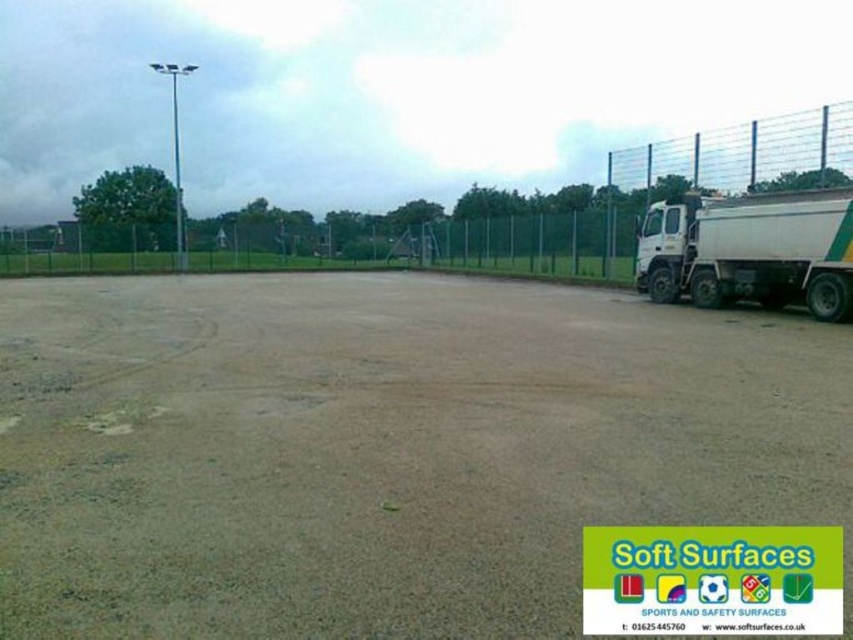
Which of these two, brown gravel dirt field at center or white matte truck at right, stands taller?

brown gravel dirt field at center

Is brown gravel dirt field at center positioned before white matte truck at right?

Yes, it is in front of white matte truck at right.

Who is more forward, (708, 397) or (820, 314)?

Point (708, 397) is in front.

Where is `brown gravel dirt field at center`? The width and height of the screenshot is (853, 640). brown gravel dirt field at center is located at coordinates (381, 449).

Which of these two, white matte truck at right or metal mesh fence at upper right, stands shorter?

Standing shorter between the two is white matte truck at right.

Based on the photo, is white matte truck at right behind metal mesh fence at upper right?

No, white matte truck at right is in front of metal mesh fence at upper right.

Who is more forward, [811,252] or [843,131]?

Point [811,252] is in front.

Where is `white matte truck at right`? The height and width of the screenshot is (640, 853). white matte truck at right is located at coordinates (750, 250).

Does brown gravel dirt field at center have a smaller size compared to metal mesh fence at upper right?

Yes, brown gravel dirt field at center is smaller than metal mesh fence at upper right.

Between point (790, 454) and point (695, 164), which one is positioned behind?

The point (695, 164) is behind.

This screenshot has height=640, width=853. In order to click on brown gravel dirt field at center in this screenshot , I will do coord(381,449).